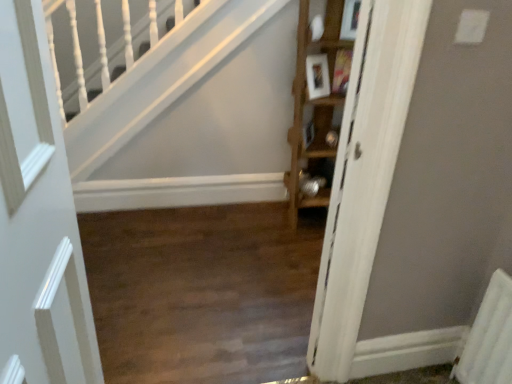
Question: Does wooden floor at center have a smaller size compared to wooden cabinet at right?

Choices:
 (A) no
 (B) yes

Answer: (B)

Question: Is wooden floor at center positioned beyond the bounds of wooden cabinet at right?

Choices:
 (A) no
 (B) yes

Answer: (B)

Question: Is wooden floor at center not close to wooden cabinet at right?

Choices:
 (A) no
 (B) yes

Answer: (A)

Question: From the image's perspective, is wooden floor at center beneath wooden cabinet at right?

Choices:
 (A) no
 (B) yes

Answer: (B)

Question: Is wooden floor at center at the left side of wooden cabinet at right?

Choices:
 (A) yes
 (B) no

Answer: (A)

Question: Relative to wooden floor at center, is white matte door at left in front or behind?

Choices:
 (A) front
 (B) behind

Answer: (A)

Question: Would you say white matte door at left is inside or outside wooden floor at center?

Choices:
 (A) inside
 (B) outside

Answer: (B)

Question: Considering the positions of point (29, 160) and point (231, 249), is point (29, 160) closer or farther from the camera than point (231, 249)?

Choices:
 (A) closer
 (B) farther

Answer: (A)

Question: Considering the positions of white matte door at left and wooden floor at center in the image, is white matte door at left bigger or smaller than wooden floor at center?

Choices:
 (A) small
 (B) big

Answer: (A)

Question: Is wooden floor at center to the left or to the right of white matte door at left in the image?

Choices:
 (A) left
 (B) right

Answer: (B)

Question: Considering the positions of wooden floor at center and white matte door at left in the image, is wooden floor at center wider or thinner than white matte door at left?

Choices:
 (A) thin
 (B) wide

Answer: (B)

Question: Is wooden floor at center in front of or behind white matte door at left in the image?

Choices:
 (A) behind
 (B) front

Answer: (A)

Question: Does point (163, 326) appear closer or farther from the camera than point (54, 223)?

Choices:
 (A) closer
 (B) farther

Answer: (B)

Question: From a real-world perspective, is wooden floor at center above or below wooden cabinet at right?

Choices:
 (A) below
 (B) above

Answer: (A)

Question: Choose the correct answer: Is wooden floor at center inside wooden cabinet at right or outside it?

Choices:
 (A) outside
 (B) inside

Answer: (A)